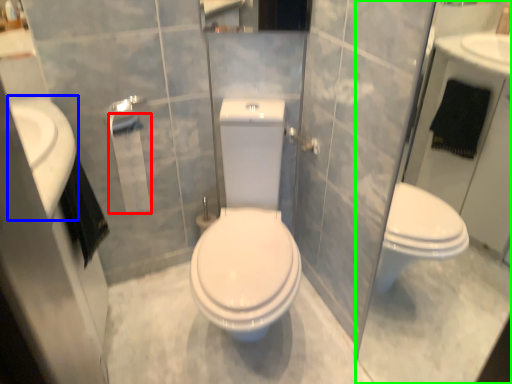
Question: Which object is positioned farthest from toilet paper (highlighted by a red box)? Select from sink (highlighted by a blue box) and glass door (highlighted by a green box).

Choices:
 (A) sink
 (B) glass door

Answer: (B)